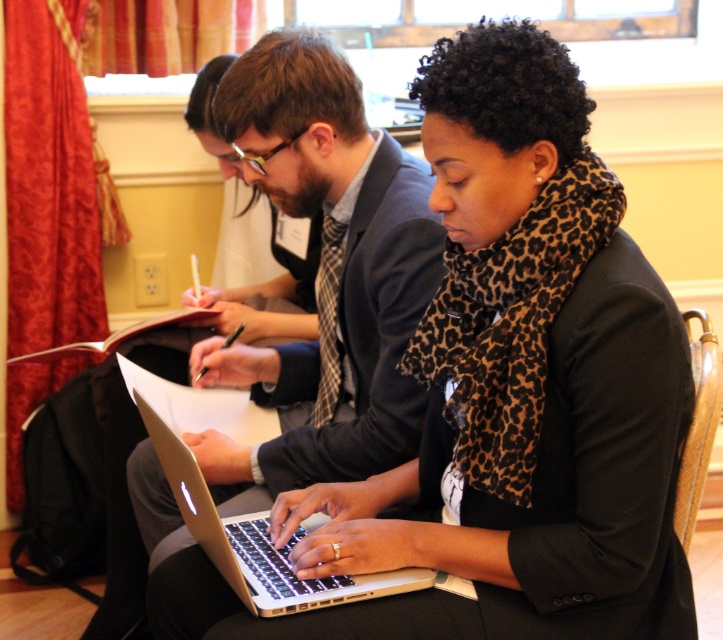
Describe the element at coordinates (505, 394) in the screenshot. This screenshot has height=640, width=723. I see `matte black laptop at center` at that location.

Who is positioned more to the left, matte black laptop at center or silver metallic laptop at center?

Positioned to the left is silver metallic laptop at center.

Where is `matte black laptop at center`? This screenshot has height=640, width=723. matte black laptop at center is located at coordinates (505, 394).